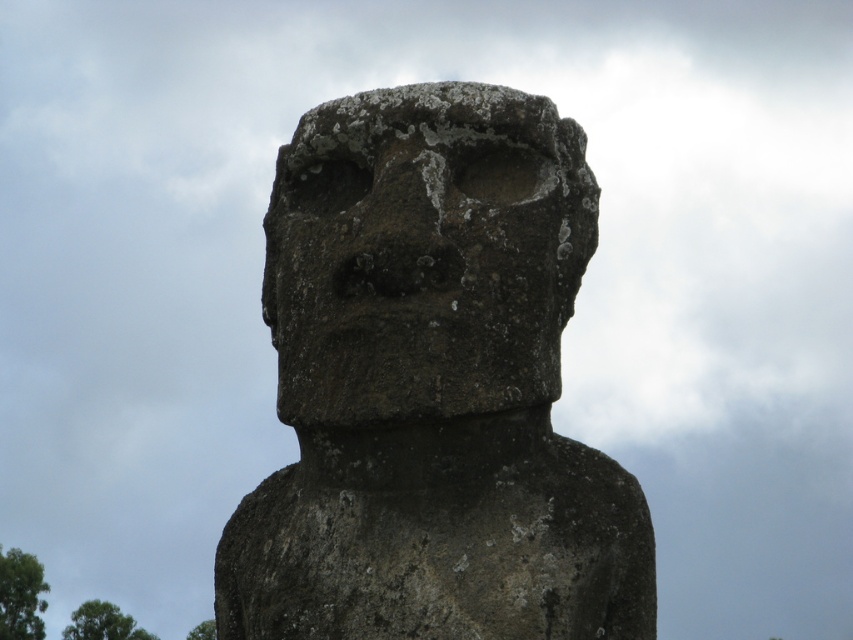
You are standing in front of the large stone statue. You notice two points marked on the statue. One is at coordinate point(584,243) and the other at point(392,232). Which point is closer to you?

Point(392,232) is closer to you because it is in front of point(584,243).

You are an archaeologist examining the statue and need to document its condition. Based on the image, what is the texture of the statue at point [431,387]?

The texture at point [431,387] is rough stone.

You are an archaeologist examining the image of the statue. Which part of the statue, the rough stone statue at center or the rough stone face at center, is closer to you?

The rough stone statue at center is closer to you than the rough stone face at center.